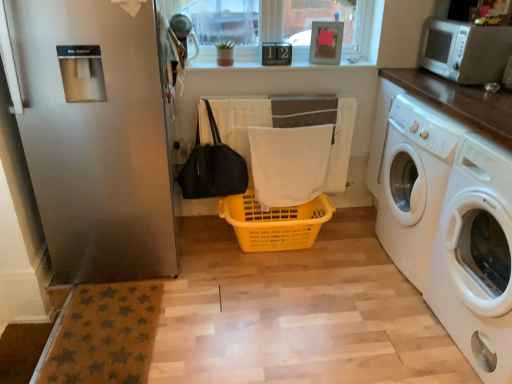
Question: Would you say white glossy washing machine at right, which ranks as the first washing machine in back-to-front order, contains black fabric bag at lower left?

Choices:
 (A) no
 (B) yes

Answer: (A)

Question: From a real-world perspective, is white glossy washing machine at right, which ranks as the first washing machine in back-to-front order, located beneath black fabric bag at lower left?

Choices:
 (A) yes
 (B) no

Answer: (A)

Question: Does white glossy washing machine at right, which is the second washing machine in front-to-back order, have a larger size compared to black fabric bag at lower left?

Choices:
 (A) yes
 (B) no

Answer: (A)

Question: Considering the relative sizes of white glossy washing machine at right, which ranks as the first washing machine in back-to-front order, and black fabric bag at lower left in the image provided, is white glossy washing machine at right, which ranks as the first washing machine in back-to-front order, wider than black fabric bag at lower left?

Choices:
 (A) no
 (B) yes

Answer: (B)

Question: Could you tell me if white glossy washing machine at right, which ranks as the first washing machine in back-to-front order, is turned towards black fabric bag at lower left?

Choices:
 (A) no
 (B) yes

Answer: (B)

Question: Would you say white fabric bath towel at center is inside or outside clear glass window at upper center?

Choices:
 (A) outside
 (B) inside

Answer: (A)

Question: From the image's perspective, is white fabric bath towel at center positioned above or below clear glass window at upper center?

Choices:
 (A) above
 (B) below

Answer: (B)

Question: In the image, is white fabric bath towel at center positioned in front of or behind clear glass window at upper center?

Choices:
 (A) behind
 (B) front

Answer: (B)

Question: Is point (288, 195) closer or farther from the camera than point (202, 46)?

Choices:
 (A) farther
 (B) closer

Answer: (A)

Question: Based on their positions, is white glossy washing machine at right, arranged as the second washing machine when viewed from the back, located to the left or right of white glossy washing machine at right, which is the second washing machine in front-to-back order?

Choices:
 (A) right
 (B) left

Answer: (A)

Question: Based on their sizes in the image, would you say white glossy washing machine at right, arranged as the second washing machine when viewed from the back, is bigger or smaller than white glossy washing machine at right, which is the second washing machine in front-to-back order?

Choices:
 (A) small
 (B) big

Answer: (A)

Question: Is white glossy washing machine at right, the 1th washing machine positioned from the front, inside or outside of white glossy washing machine at right, which ranks as the first washing machine in back-to-front order?

Choices:
 (A) outside
 (B) inside

Answer: (A)

Question: Is point (455, 314) positioned closer to the camera than point (389, 180)?

Choices:
 (A) closer
 (B) farther

Answer: (A)

Question: Is white glossy washing machine at right, arranged as the second washing machine when viewed from the back, inside or outside of white fabric bath towel at center?

Choices:
 (A) outside
 (B) inside

Answer: (A)

Question: Is white glossy washing machine at right, the 1th washing machine positioned from the front, in front of or behind white fabric bath towel at center in the image?

Choices:
 (A) front
 (B) behind

Answer: (A)